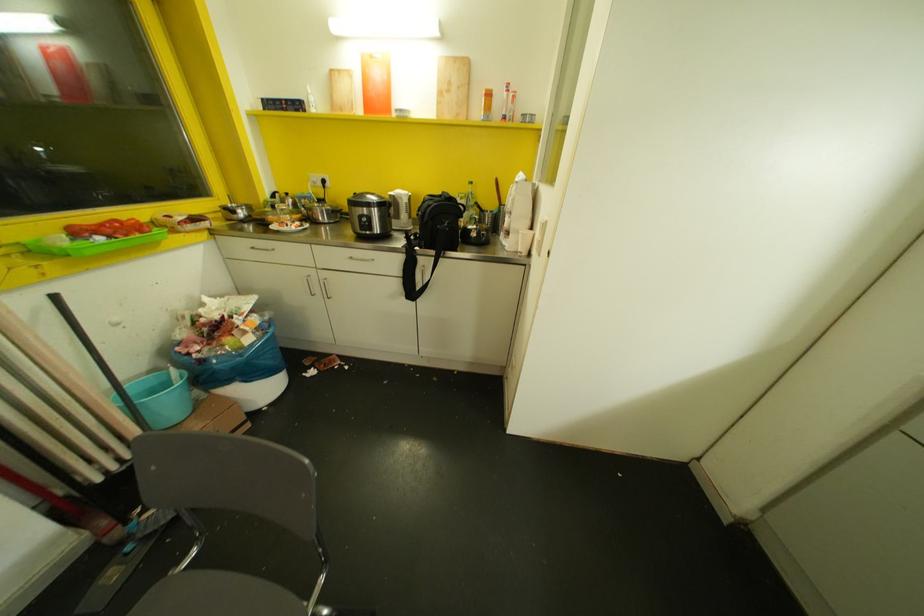
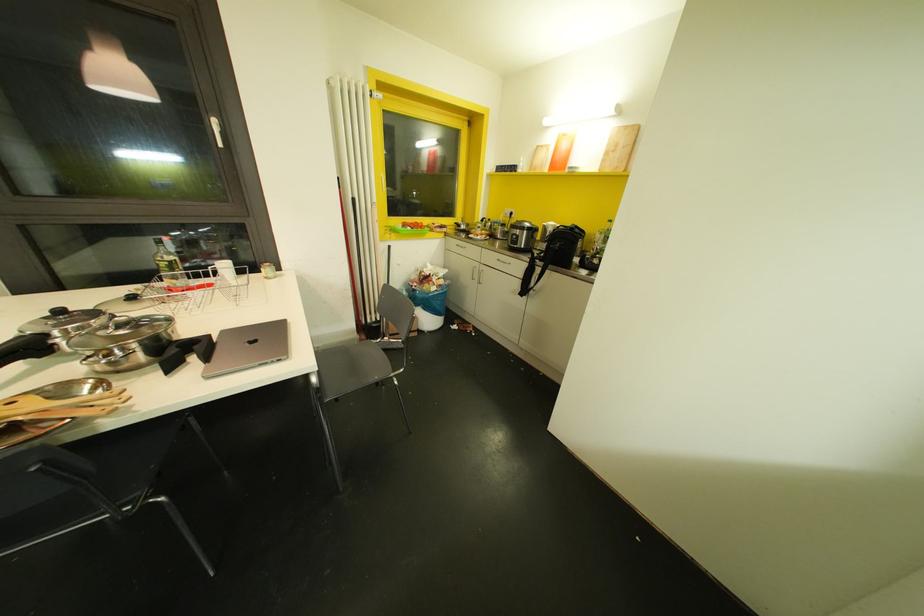
Locate, in the second image, the point that corresponds to pixel 240 245 in the first image.

(453, 243)